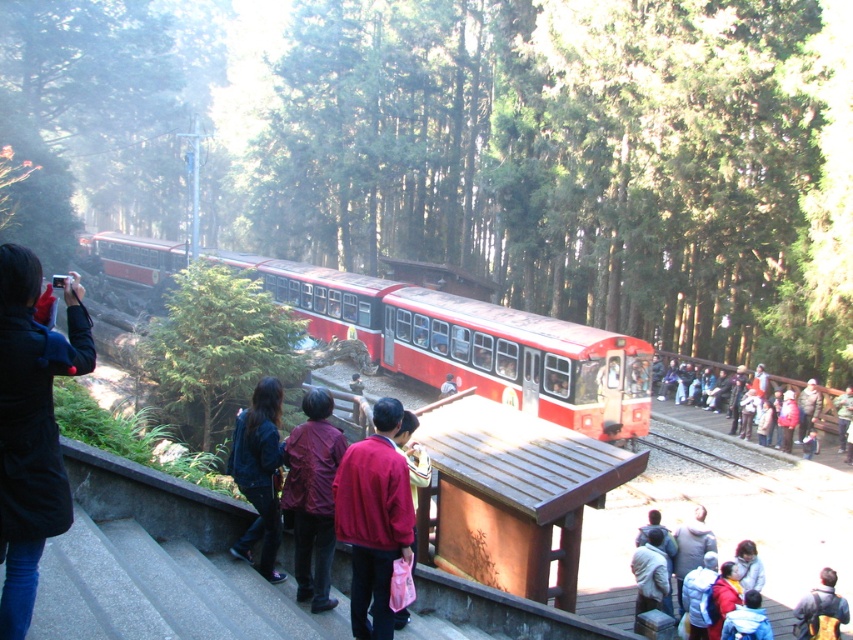
You are a photographer standing on the wooden platform at the scenic railway scene. You notice two maroon fabric garments at the center. Which garment has a wider width, the maroon fabric jacket at center or the maroon fabric coat at center?

The maroon fabric jacket at center has a wider width than the maroon fabric coat at center according to the description.

You are a photographer trying to capture a closeup of the maroon fabric coat at center and the light gray fabric jacket at lower right. Which one would you need to zoom in more on to get a detailed shot?

The maroon fabric coat at center is bigger than the light gray fabric jacket at lower right, so you would need to zoom in more on the light gray fabric jacket at lower right to get a detailed shot since it is smaller.